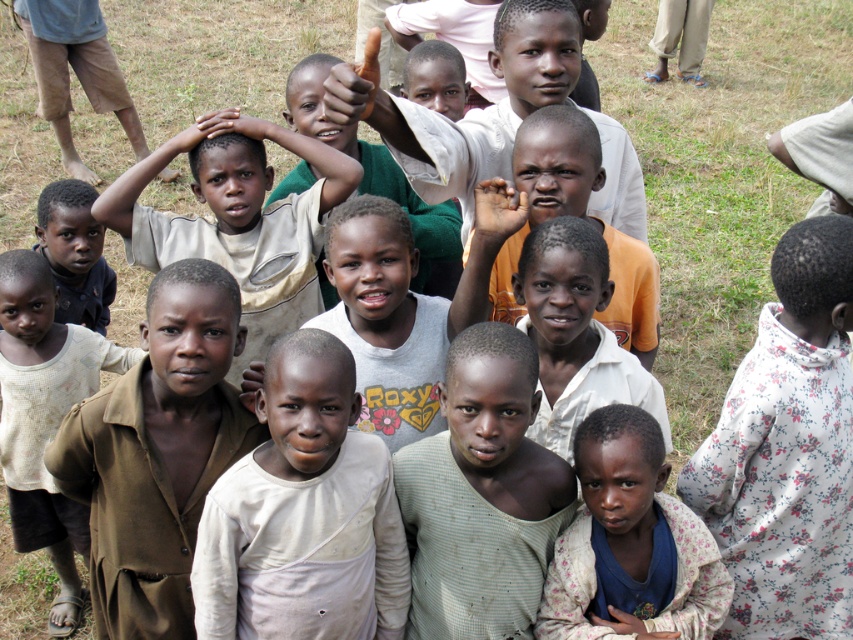
Who is positioned more to the right, white cotton shirt at center or light blue fabric shirt at lower right?

light blue fabric shirt at lower right is more to the right.

Which of these two, white cotton shirt at center or light blue fabric shirt at lower right, stands shorter?

light blue fabric shirt at lower right

Locate an element on the screen. white cotton shirt at center is located at coordinates click(303, 513).

The height and width of the screenshot is (640, 853). I want to click on brown matte shirt at center, so click(157, 452).

Does point (131, 596) come behind point (506, 273)?

No, (131, 596) is closer to viewer.

Which is in front, point (125, 456) or point (596, 316)?

Point (125, 456) is more forward.

Identify the location of brown matte shirt at center. The height and width of the screenshot is (640, 853). (157, 452).

Between point (674, 625) and point (582, 182), which one is positioned in front?

Point (674, 625) is more forward.

Is point (625, 422) positioned after point (502, 252)?

No, (625, 422) is in front of (502, 252).

You are a GUI agent. You are given a task and a screenshot of the screen. Output one action in this format:
    pyautogui.click(x=<x>, y=<y>)
    Task: Click on the light blue fabric shirt at lower right
    The image size is (853, 640).
    Given the screenshot: What is the action you would take?
    pyautogui.click(x=630, y=541)